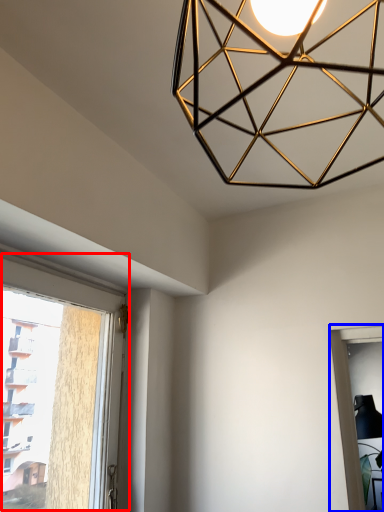
Question: Which object appears farthest to the camera in this image, window (highlighted by a red box) or window (highlighted by a blue box)?

Choices:
 (A) window
 (B) window

Answer: (B)